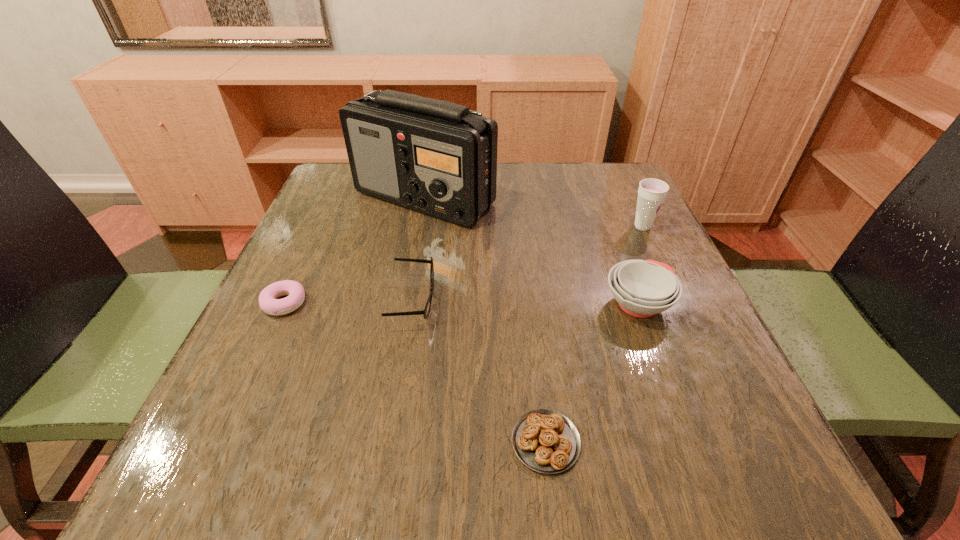
You are a GUI agent. You are given a task and a screenshot of the screen. Output one action in this format:
    pyautogui.click(x=<x>, y=<y>)
    Task: Click on the vacant area that lies between the leftmost object and the right pastry
    The height and width of the screenshot is (540, 960).
    Given the screenshot: What is the action you would take?
    pyautogui.click(x=415, y=373)

Image resolution: width=960 pixels, height=540 pixels. What are the coordinates of `vacant space that's between the fifth shortest object and the spectacles` in the screenshot? It's located at (528, 264).

Where is `blank region between the third tallest object and the radio receiver`? The image size is (960, 540). blank region between the third tallest object and the radio receiver is located at coordinates (531, 251).

This screenshot has width=960, height=540. Identify the location of vacant area that lies between the left pastry and the shortest object. (415, 373).

The height and width of the screenshot is (540, 960). I want to click on unoccupied position between the radio receiver and the farther pastry, so click(354, 251).

Image resolution: width=960 pixels, height=540 pixels. Identify the location of free spot between the third tallest object and the third object from right to left. [591, 373].

The width and height of the screenshot is (960, 540). Identify the location of vacant area that lies between the soup bowl and the farther pastry. (461, 303).

This screenshot has width=960, height=540. I want to click on object that is the fourth closest to the leftmost object, so click(x=642, y=288).

Locate an element on the screen. This screenshot has height=540, width=960. object that is the third closest to the fourth tallest object is located at coordinates [546, 441].

The width and height of the screenshot is (960, 540). Find the location of `vacant area in the image that satisfies the following two spatial constraints: 1. on the front-facing side of the fourth tallest object; 2. on the back side of the soup bowl`. vacant area in the image that satisfies the following two spatial constraints: 1. on the front-facing side of the fourth tallest object; 2. on the back side of the soup bowl is located at coordinates (413, 304).